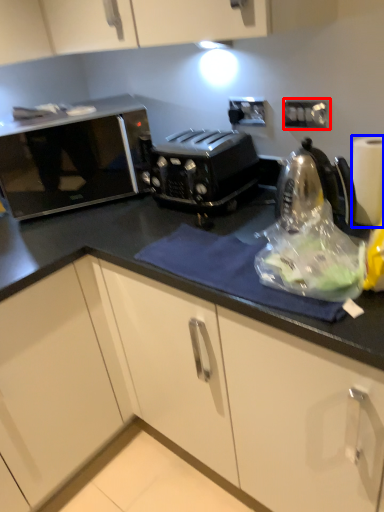
Question: Which object is closer to the camera taking this photo, electric outlet (highlighted by a red box) or paper towel (highlighted by a blue box)?

Choices:
 (A) electric outlet
 (B) paper towel

Answer: (B)